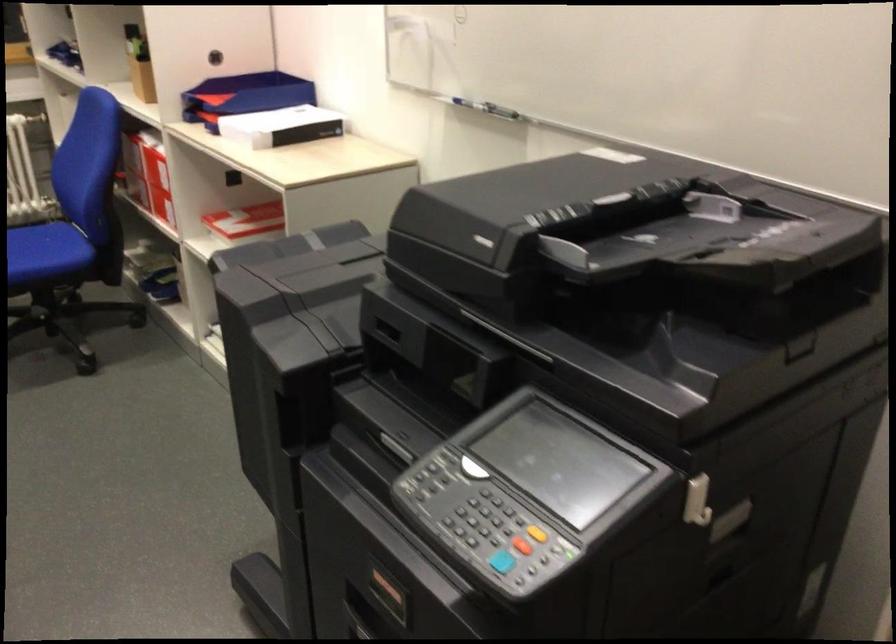
Locate an element on the screen. This screenshot has height=644, width=896. blue chair sitting surface is located at coordinates (42, 243).